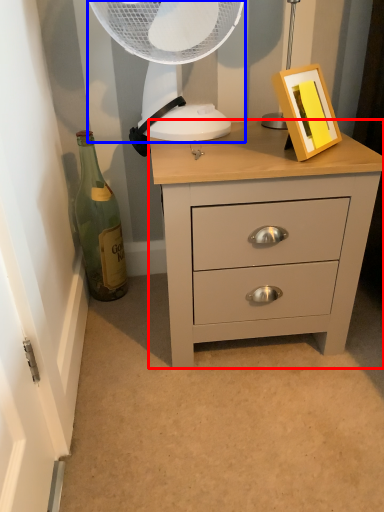
Question: Which point is closer to the camera, chest of drawers (highlighted by a red box) or mechanical fan (highlighted by a blue box)?

Choices:
 (A) chest of drawers
 (B) mechanical fan

Answer: (A)